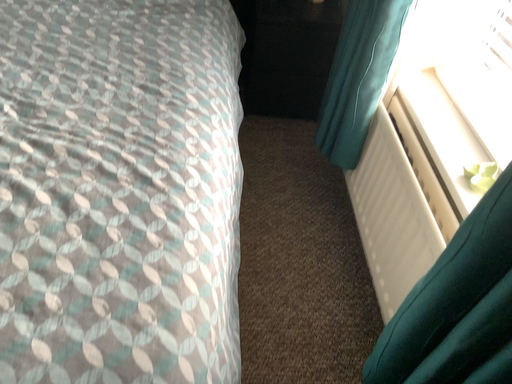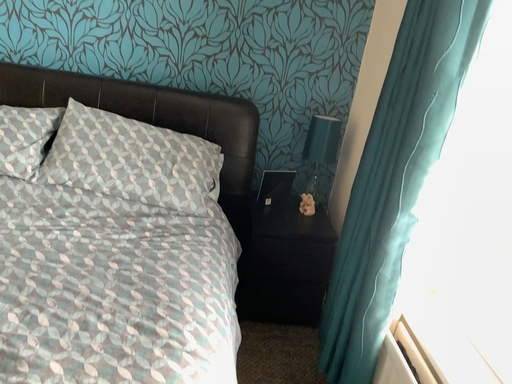
Question: How did the camera likely rotate when shooting the video?

Choices:
 (A) rotated downward
 (B) rotated upward

Answer: (B)